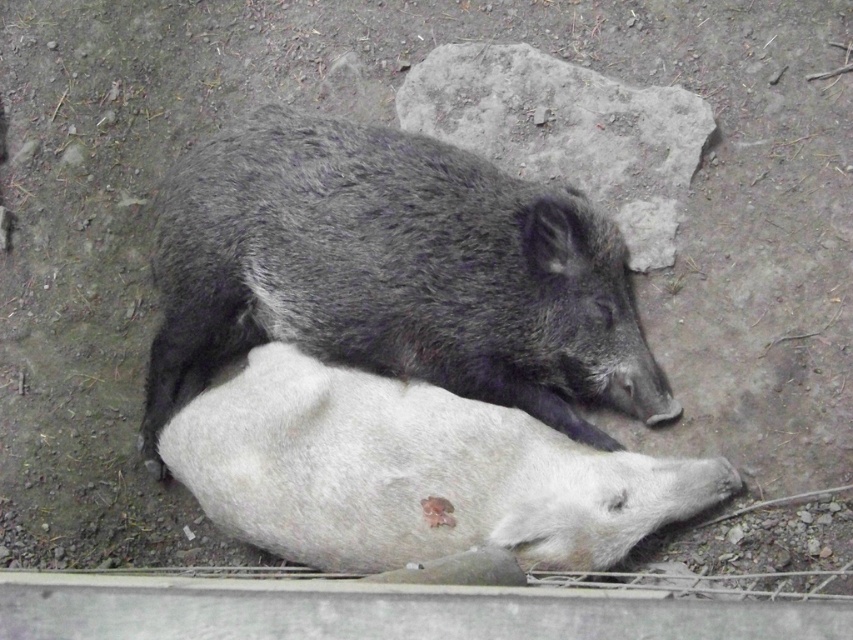
Question: Which of these objects is positioned farthest from the gray fur pig at center?

Choices:
 (A) white matte pig at center
 (B) gray rough rock at upper center

Answer: (B)

Question: Is white matte pig at center wider than gray rough rock at upper center?

Choices:
 (A) no
 (B) yes

Answer: (B)

Question: Which of the following is the closest to the observer?

Choices:
 (A) white matte pig at center
 (B) gray rough rock at upper center

Answer: (A)

Question: Is gray fur pig at center further to camera compared to white matte pig at center?

Choices:
 (A) yes
 (B) no

Answer: (A)

Question: Considering the real-world distances, which object is closest to the gray rough rock at upper center?

Choices:
 (A) white matte pig at center
 (B) gray fur pig at center

Answer: (B)

Question: Is gray fur pig at center smaller than white matte pig at center?

Choices:
 (A) no
 (B) yes

Answer: (A)